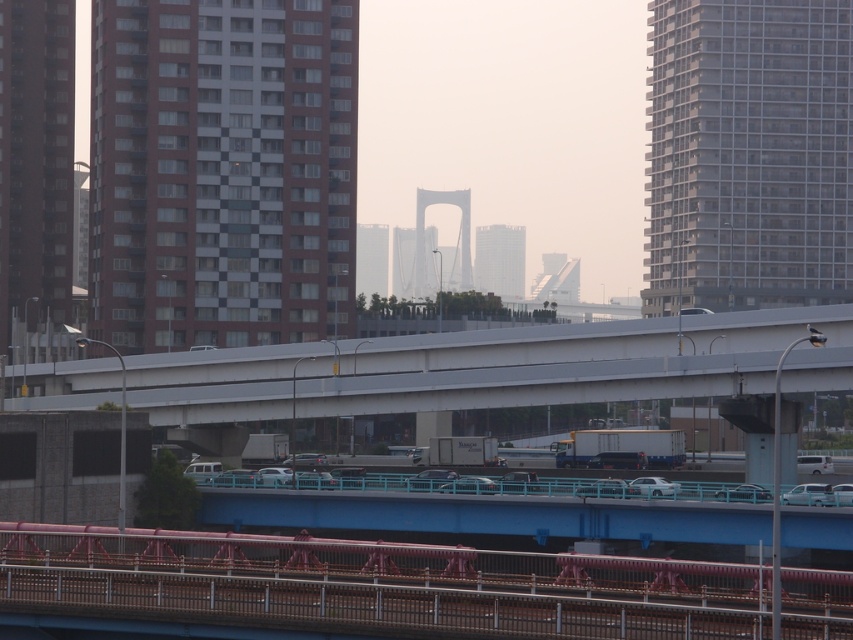
Question: From the image, what is the correct spatial relationship of white concrete overpass at center in relation to brown textured building at left?

Choices:
 (A) right
 (B) left

Answer: (A)

Question: Considering the real-world distances, which object is closest to the smooth glass skyscraper at center?

Choices:
 (A) gray glass building at upper right
 (B) brick textured building at left

Answer: (A)

Question: Does brown textured building at left have a smaller size compared to white glass tower at center?

Choices:
 (A) no
 (B) yes

Answer: (B)

Question: Which of the following is the closest to the observer?

Choices:
 (A) gray glass building at upper right
 (B) brick textured building at left
 (C) white glossy sedan at center

Answer: (C)

Question: Is rusty metal train track at lower center to the left of gray glass building at upper right from the viewer's perspective?

Choices:
 (A) no
 (B) yes

Answer: (B)

Question: Which object appears closest to the camera in this image?

Choices:
 (A) smooth glass skyscraper at center
 (B) white concrete overpass at center

Answer: (B)